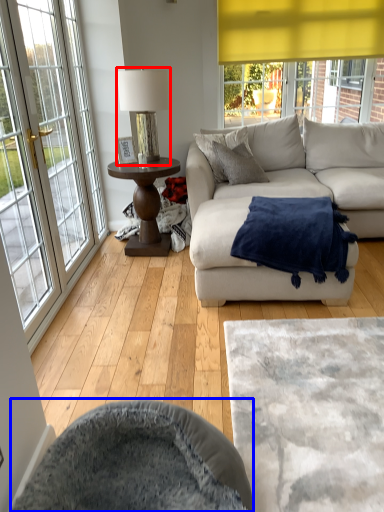
Question: Which of the following is the farthest to the observer, table lamp (highlighted by a red box) or swivel chair (highlighted by a blue box)?

Choices:
 (A) table lamp
 (B) swivel chair

Answer: (A)